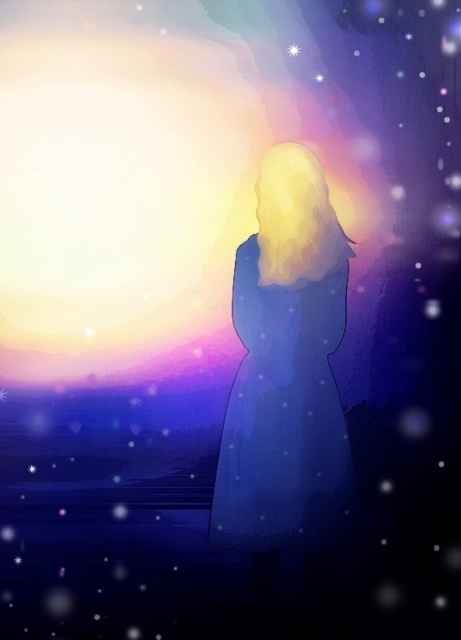
Does matte blue dress at center have a larger size compared to bright white star at upper center?

Yes, matte blue dress at center is bigger than bright white star at upper center.

Does matte blue dress at center appear under bright white star at upper center?

Yes.

Between point (241, 488) and point (294, 44), which one is positioned in front?

Point (294, 44) is more forward.

Identify the location of matte blue dress at center. The image size is (461, 640). (287, 371).